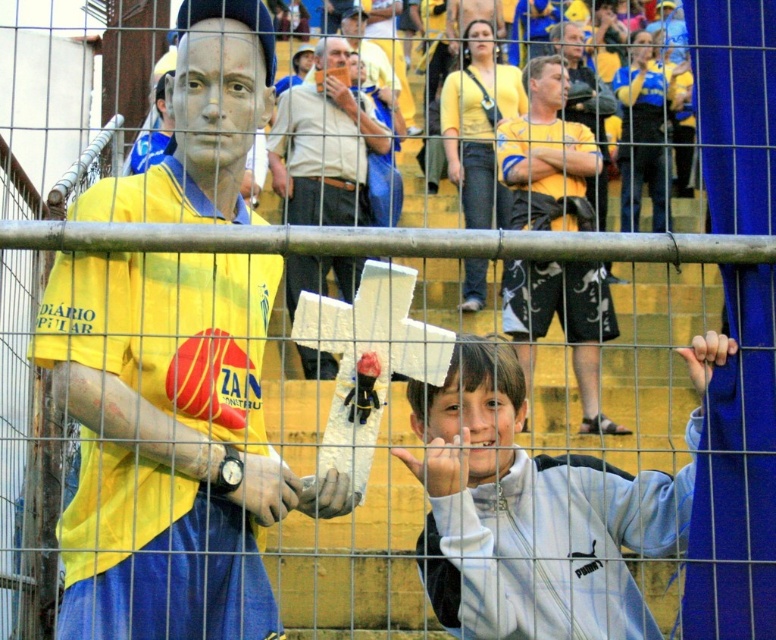
You are a photographer standing at the camera position. You want to take a photo of the person in the yellow and blue jersey holding the white foam cross. However, there is an obstruction at point (x=664, y=518). Can you determine if the obstruction is closer to you than the subject?

The distance between point (x=664, y=518) and the camera is 60.82 meters. However, the exact distance of the subject to the camera isn

You are a photographer standing at the edge of the soccer field. You need to take a photo that includes both the white matte jacket at lower right and the yellow jersey at center. Which object should you adjust your camera focus to first to ensure both are in the frame?

You should focus on the white matte jacket at lower right first since it is closer to the viewer than the yellow jersey at center, ensuring both are in the frame by adjusting focus from near to far.